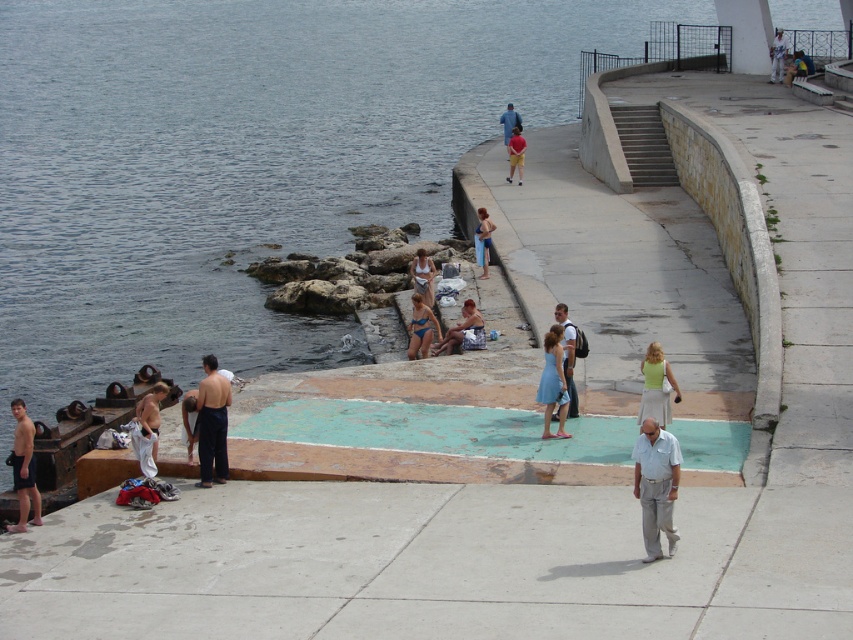
You are standing at the point marked by the coordinates point (x=656, y=387). What object is located exactly at this coordinate?

The point (x=656, y=387) marks the green jersey skirt at center.

You are standing at the center of the waterfront promenade and see the light blue fabric dress at center. According to the coordinates provided, is the dress located closer to the top or bottom half of the image?

The light blue fabric dress at center is located at point 0.649 on the vertical axis, which places it closer to the bottom half of the image since 0.649 is less than 0.75.